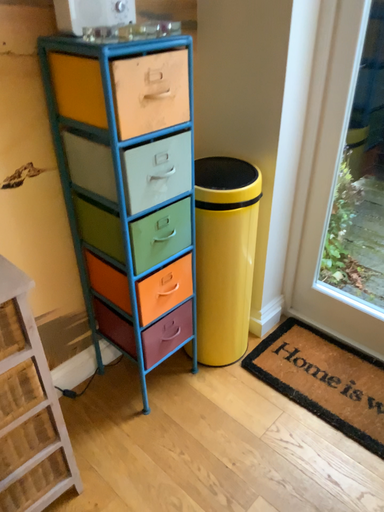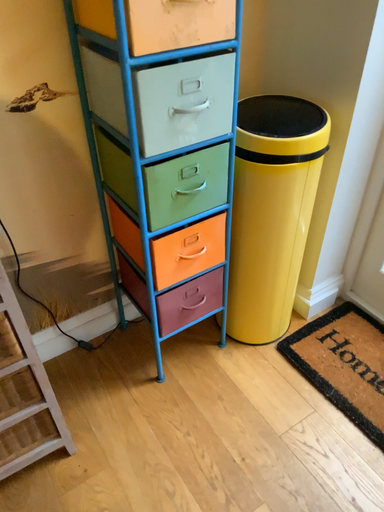
Question: Which way did the camera rotate in the video?

Choices:
 (A) rotated left
 (B) rotated right

Answer: (A)